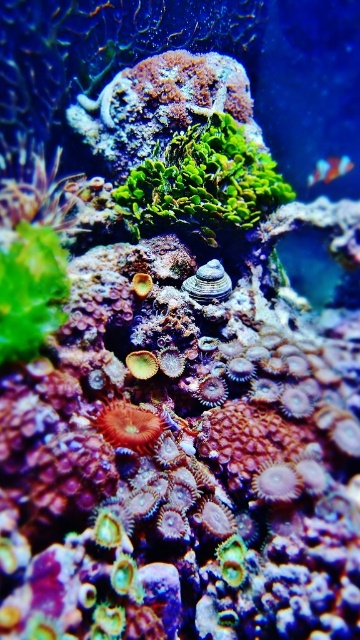
Does point (228, 177) come closer to viewer compared to point (36, 326)?

No, it is behind (36, 326).

Which of these two, green matte algae at center or green leafy plant at left, stands taller?

Standing taller between the two is green matte algae at center.

Image resolution: width=360 pixels, height=640 pixels. Describe the element at coordinates (203, 182) in the screenshot. I see `green matte algae at center` at that location.

The width and height of the screenshot is (360, 640). In order to click on green matte algae at center in this screenshot , I will do `click(203, 182)`.

Between point (209, 212) and point (99, 416), which one is positioned in front?

Point (99, 416) is more forward.

In the scene shown: Between green matte algae at center and red coral at center, which one has less height?

Standing shorter between the two is red coral at center.

Locate an element on the screen. green matte algae at center is located at coordinates (203, 182).

Find the location of a particular element. green matte algae at center is located at coordinates [203, 182].

Can you confirm if green leafy plant at left is wider than shiny blue fish at upper right?

Incorrect, green leafy plant at left's width does not surpass shiny blue fish at upper right's.

From the picture: Does green leafy plant at left have a larger size compared to shiny blue fish at upper right?

Yes, green leafy plant at left is bigger than shiny blue fish at upper right.

Who is more distant from viewer, (5, 253) or (326, 179)?

The point (326, 179) is behind.

Locate an element on the screen. The width and height of the screenshot is (360, 640). green leafy plant at left is located at coordinates (30, 291).